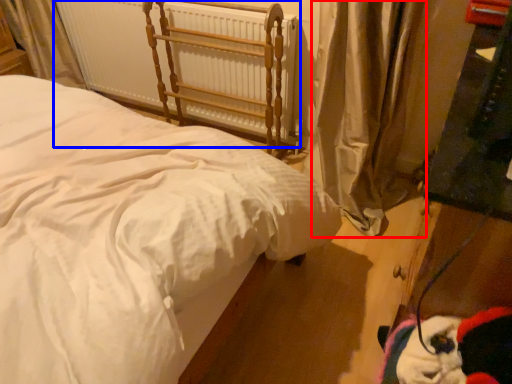
Question: Which object appears farthest to the camera in this image, curtain (highlighted by a red box) or radiator (highlighted by a blue box)?

Choices:
 (A) curtain
 (B) radiator

Answer: (B)